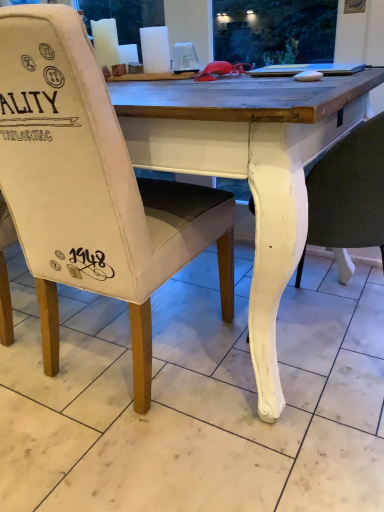
This screenshot has width=384, height=512. Identify the location of free location in front of white painted wood chair at lower right, which appears as the first chair when viewed from the right. (302, 435).